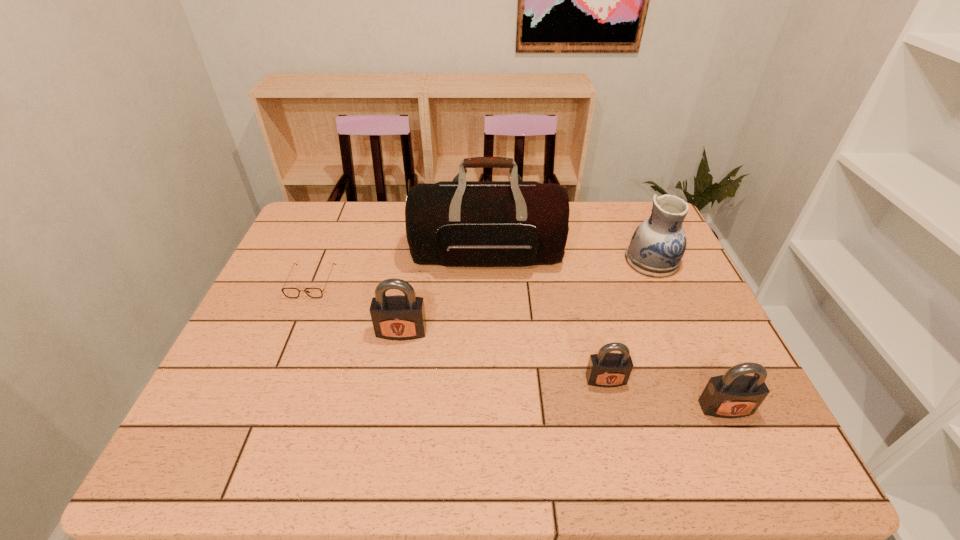
Locate an element on the screen. Image resolution: width=960 pixels, height=540 pixels. padlock that is the third closest to the shortest object is located at coordinates (733, 395).

In order to click on padlock that is the closest to the rightmost padlock in this screenshot , I will do `click(605, 369)`.

Image resolution: width=960 pixels, height=540 pixels. Find the location of `free space that satisfies the following two spatial constraints: 1. on the front pocket of the tallest object; 2. on the left side of the second tallest object`. free space that satisfies the following two spatial constraints: 1. on the front pocket of the tallest object; 2. on the left side of the second tallest object is located at coordinates (488, 260).